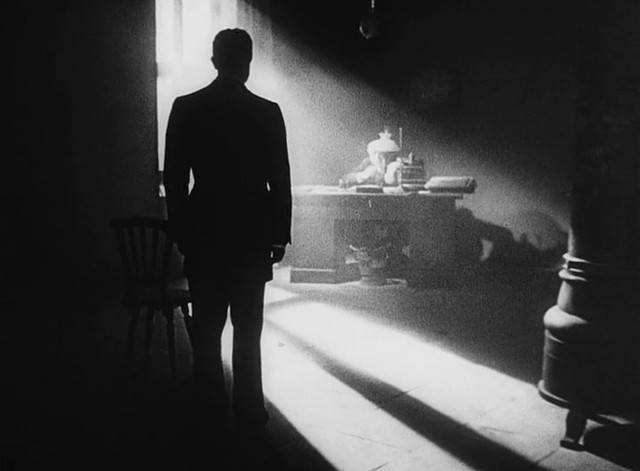
You are a GUI agent. You are given a task and a screenshot of the screen. Output one action in this format:
    pyautogui.click(x=<x>, y=<y>)
    Task: Click on the man sitting at desk
    The image size is (640, 471).
    Given the screenshot: What is the action you would take?
    pyautogui.click(x=377, y=168)